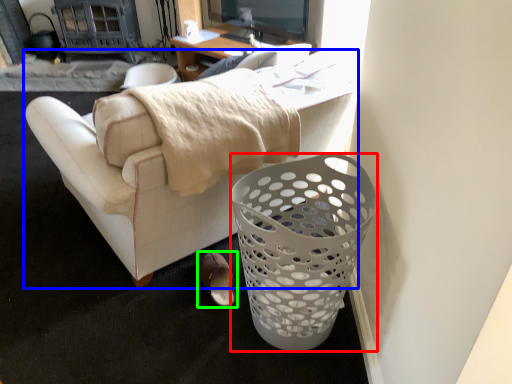
Question: Considering the real-world distances, which object is farthest from trash bin/can (highlighted by a red box)? studio couch (highlighted by a blue box) or footwear (highlighted by a green box)?

Choices:
 (A) studio couch
 (B) footwear

Answer: (B)